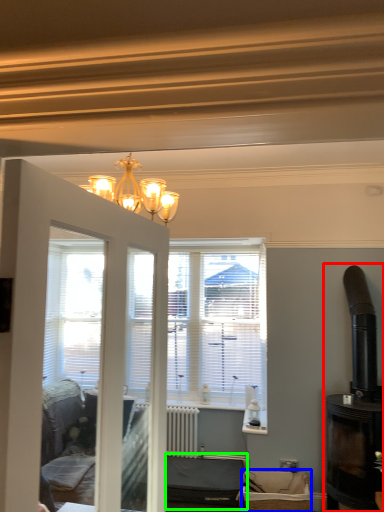
Question: Considering the real-world distances, which object is farthest from fireplace (highlighted by a red box)? furniture (highlighted by a blue box) or furniture (highlighted by a green box)?

Choices:
 (A) furniture
 (B) furniture

Answer: (B)